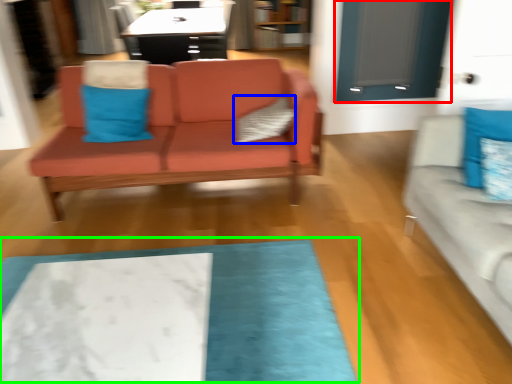
Question: Which object is the closest to the glass door (highlighted by a red box)? Choose among these: pillow (highlighted by a blue box) or mat (highlighted by a green box).

Choices:
 (A) pillow
 (B) mat

Answer: (A)